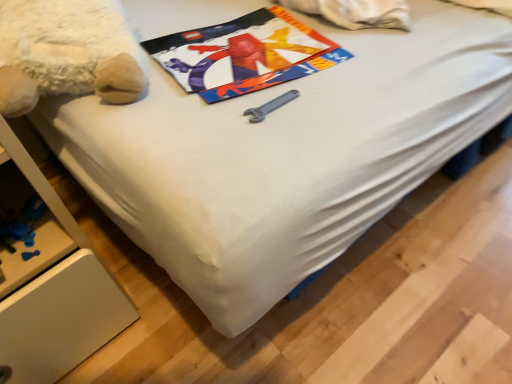
Question: Based on their positions, is fluffy white teddy bear at upper left located to the left or right of metallic poster at center?

Choices:
 (A) left
 (B) right

Answer: (A)

Question: Considering their positions, is fluffy white teddy bear at upper left located in front of or behind metallic poster at center?

Choices:
 (A) behind
 (B) front

Answer: (B)

Question: Is fluffy white teddy bear at upper left situated inside metallic poster at center or outside?

Choices:
 (A) outside
 (B) inside

Answer: (A)

Question: Based on their positions, is metallic poster at center located to the left or right of fluffy white teddy bear at upper left?

Choices:
 (A) left
 (B) right

Answer: (B)

Question: In terms of width, does metallic poster at center look wider or thinner when compared to fluffy white teddy bear at upper left?

Choices:
 (A) wide
 (B) thin

Answer: (B)

Question: Considering the positions of point (241, 84) and point (110, 96), is point (241, 84) closer or farther from the camera than point (110, 96)?

Choices:
 (A) farther
 (B) closer

Answer: (A)

Question: Is metallic poster at center taller or shorter than fluffy white teddy bear at upper left?

Choices:
 (A) short
 (B) tall

Answer: (A)